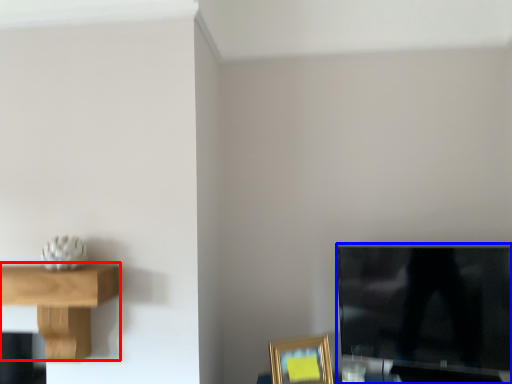
Question: Which of the following is the farthest to the observer, shelf (highlighted by a red box) or television (highlighted by a blue box)?

Choices:
 (A) shelf
 (B) television

Answer: (B)